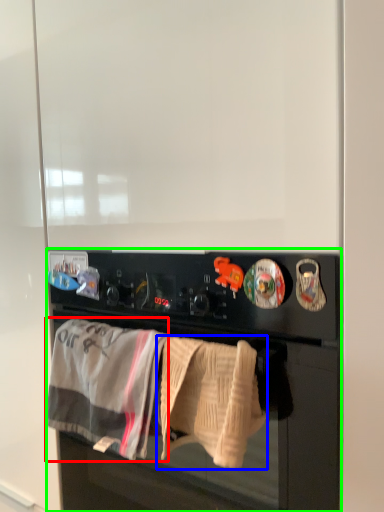
Question: Which is nearer to the bath towel (highlighted by a red box)? bath towel (highlighted by a blue box) or home appliance (highlighted by a green box).

Choices:
 (A) bath towel
 (B) home appliance

Answer: (A)